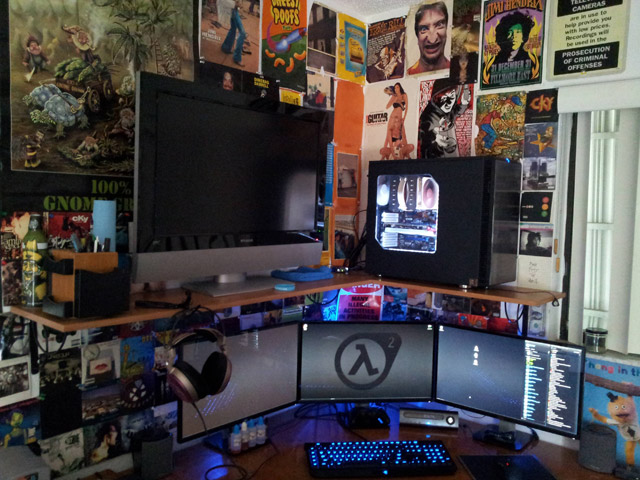
What are the coordinates of `brown wood desk` in the screenshot? It's located at (289, 453).